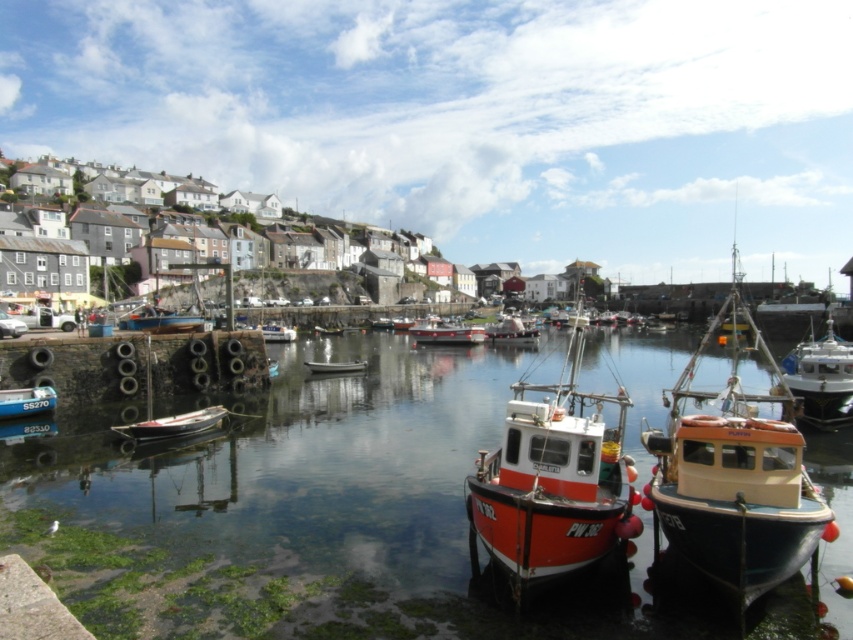
Question: Estimate the real-world distances between objects in this image. Which object is closer to the white wooden boat at center?

Choices:
 (A) blue wooden boat at center
 (B) clear water at center

Answer: (A)

Question: Is white wooden boat at right bigger than blue wooden boat at center?

Choices:
 (A) yes
 (B) no

Answer: (A)

Question: Can you confirm if matte black boat at lower left is wider than white matte boat at center?

Choices:
 (A) yes
 (B) no

Answer: (B)

Question: Estimate the real-world distances between objects in this image. Which object is closer to the wooden boat at lower left?

Choices:
 (A) white matte boat at center
 (B) white wooden boat at center

Answer: (A)

Question: From the image, what is the correct spatial relationship of red glossy boat at center in relation to matte black boat at lower left?

Choices:
 (A) left
 (B) right

Answer: (B)

Question: Which of the following is the closest to the observer?

Choices:
 (A) (583, 484)
 (B) (466, 330)
 (C) (6, 390)

Answer: (A)